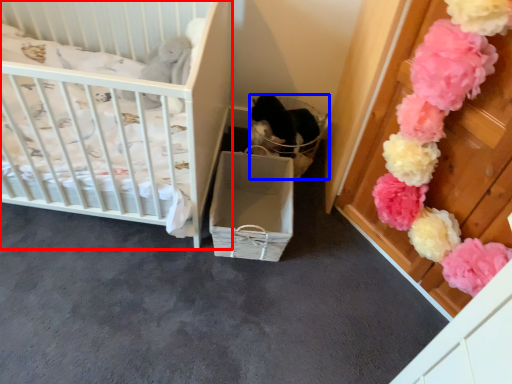
Question: Which point is further to the camera, infant bed (highlighted by a red box) or basket (highlighted by a blue box)?

Choices:
 (A) infant bed
 (B) basket

Answer: (B)